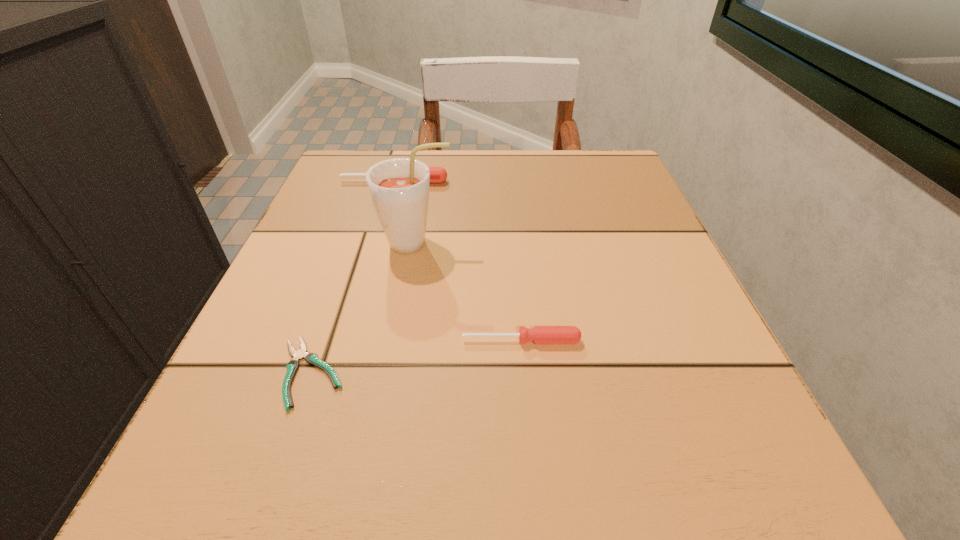
The width and height of the screenshot is (960, 540). I want to click on root beer, so click(x=399, y=187).

This screenshot has height=540, width=960. What are the coordinates of `the tallest object` in the screenshot? It's located at (399, 187).

Locate an element on the screen. The image size is (960, 540). the farther screwdriver is located at coordinates (437, 174).

Where is `the left screwdriver`? the left screwdriver is located at coordinates (437, 174).

You are a GUI agent. You are given a task and a screenshot of the screen. Output one action in this format:
    pyautogui.click(x=<x>, y=<y>)
    Task: Click on the second shortest object
    The width and height of the screenshot is (960, 540).
    Given the screenshot: What is the action you would take?
    pyautogui.click(x=539, y=334)

Image resolution: width=960 pixels, height=540 pixels. I want to click on the shorter screwdriver, so click(x=539, y=334).

In order to click on pliers in this screenshot , I will do `click(311, 358)`.

Where is `vacant space positioned 0.170m on the drink side of the root beer`? vacant space positioned 0.170m on the drink side of the root beer is located at coordinates (548, 244).

You are a GUI agent. You are given a task and a screenshot of the screen. Output one action in this format:
    pyautogui.click(x=<x>, y=<y>)
    Task: Click on the vacant region located 0.270m on the right of the left screwdriver
    The image size is (960, 540).
    Given the screenshot: What is the action you would take?
    pyautogui.click(x=573, y=181)

Where is `free spot located 0.150m on the front of the nearer screwdriver`? Image resolution: width=960 pixels, height=540 pixels. free spot located 0.150m on the front of the nearer screwdriver is located at coordinates (531, 450).